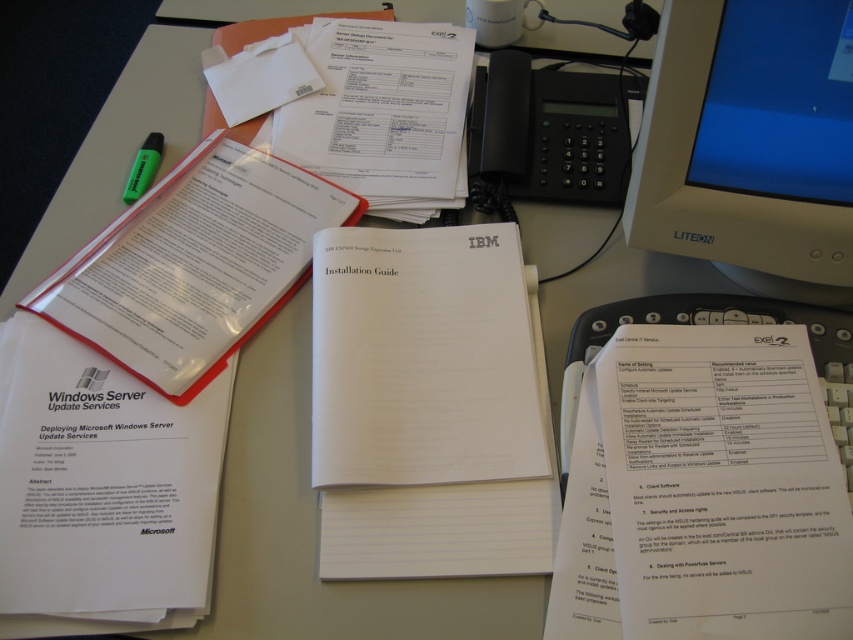
You are a technician standing 6 feet away from the desk. You need to adjust the settings on the white plastic monitor at upper right. Can you reach it from your current position without moving closer?

The white plastic monitor at upper right is 20.68 inches away from the camera. Since you are 6 feet away, which is approximately 72 inches, you are much farther than the required distance. Therefore, you can easily reach the white plastic monitor at upper right without moving closer.

You are organizing your desk and want to place the green matte highlighter at upper left closer to the white plastic monitor at upper right. Which direction should you move the highlighter to achieve this?

To move the green matte highlighter at upper left closer to the white plastic monitor at upper right, you should move it downward since the white plastic monitor at upper right is below the green matte highlighter at upper left.